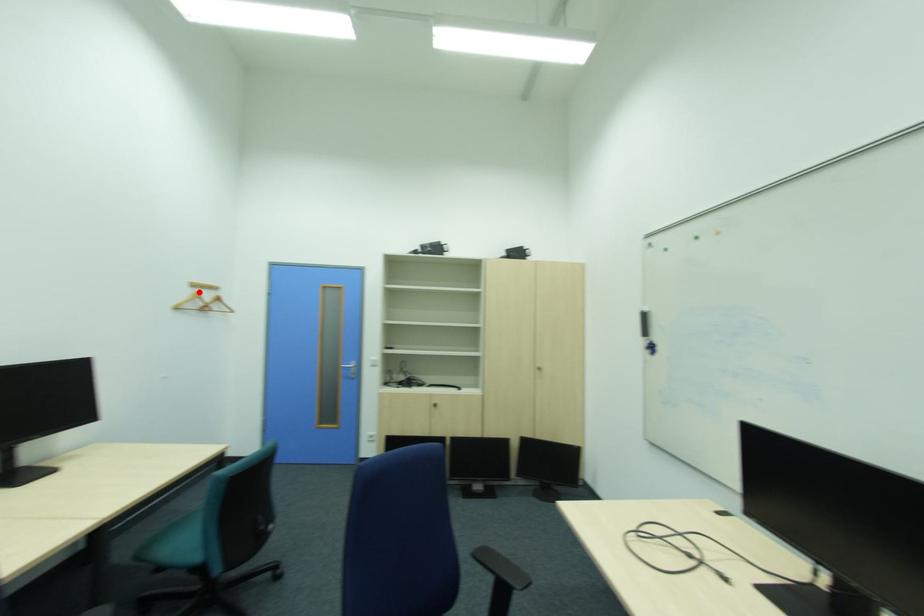
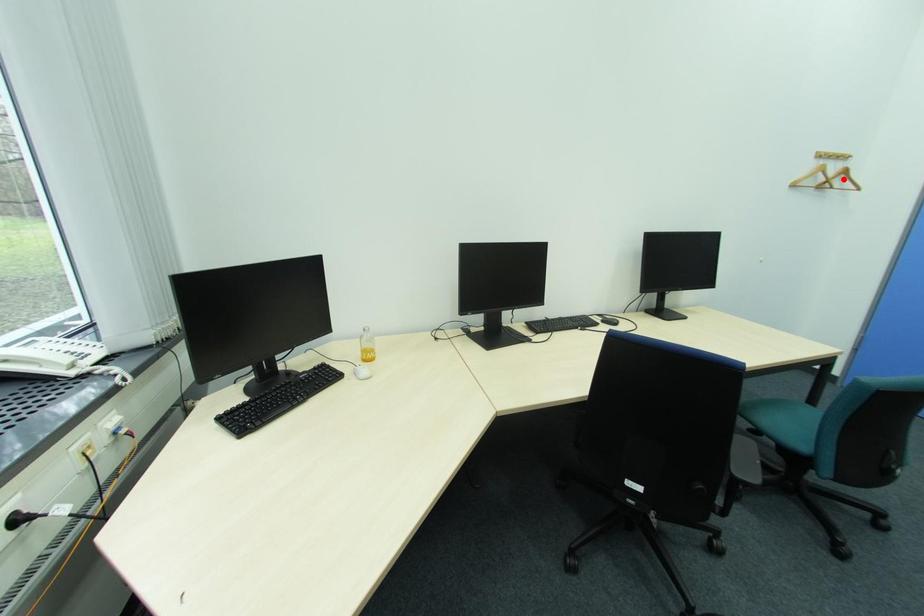
I am providing you with two images of the same scene from different viewpoints. A red point is marked on the first image and another point is marked on the second image. Is the marked point in image1 the same physical position as the marked point in image2?

No